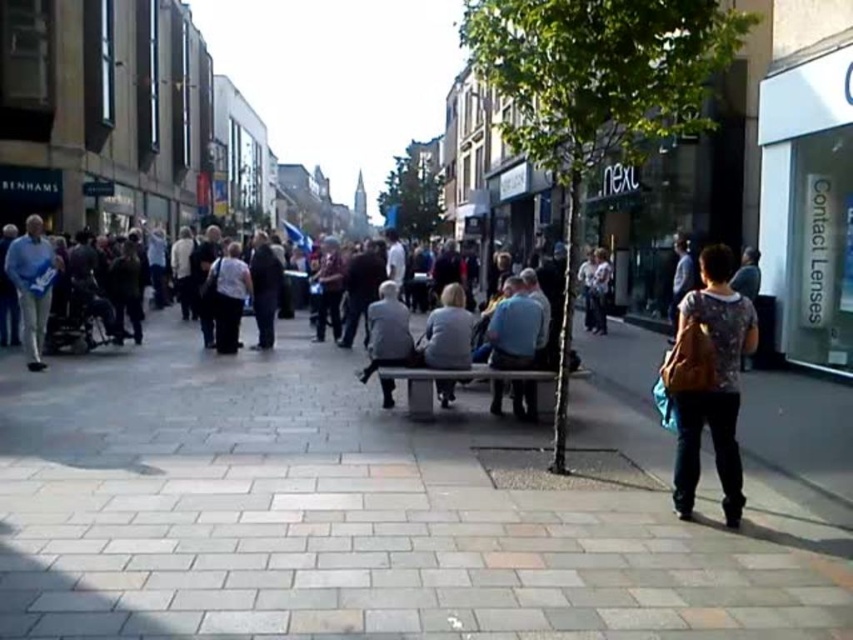
You are a delivery person trying to navigate through the dark gray concrete crowd at center and the light blue fabric bag at left. Which object is located higher up from the ground?

The light blue fabric bag at left is higher up from the ground than the dark gray concrete crowd at center because the dark gray concrete crowd at center is below the light blue fabric bag at left.

You are a delivery person who needs to place a package at the exact location where the light blue fabric bag at left is currently located. According to the scene description, where should you place the package?

The light blue fabric bag at left is located at point [32,284], so you should place the package at that coordinate.